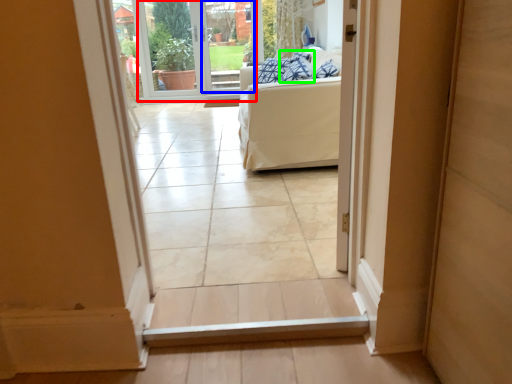
Question: Based on their relative distances, which object is nearer to window screen (highlighted by a red box)? Choose from glass door (highlighted by a blue box) and pillow (highlighted by a green box).

Choices:
 (A) glass door
 (B) pillow

Answer: (A)